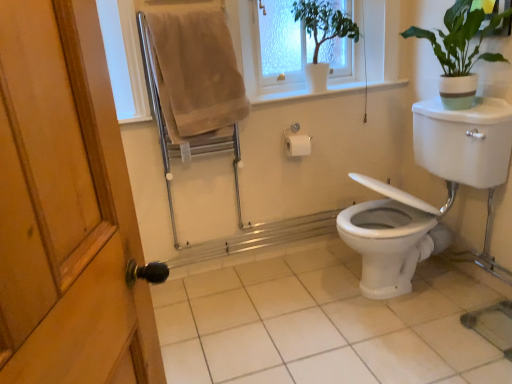
Question: From the image's perspective, does beige cotton towel at upper left appear lower than white glossy tile at center?

Choices:
 (A) no
 (B) yes

Answer: (A)

Question: Is beige cotton towel at upper left to the left of white glossy tile at center from the viewer's perspective?

Choices:
 (A) no
 (B) yes

Answer: (B)

Question: From the image's perspective, does beige cotton towel at upper left appear higher than white glossy tile at center?

Choices:
 (A) yes
 (B) no

Answer: (A)

Question: Can you confirm if beige cotton towel at upper left is shorter than white glossy tile at center?

Choices:
 (A) no
 (B) yes

Answer: (A)

Question: Could white glossy tile at center be considered to be inside beige cotton towel at upper left?

Choices:
 (A) yes
 (B) no

Answer: (B)

Question: From the image's perspective, is white glossy toilet at lower right positioned above or below white plastic window frame at upper center?

Choices:
 (A) below
 (B) above

Answer: (A)

Question: From a real-world perspective, relative to white plastic window frame at upper center, is white glossy toilet at lower right vertically above or below?

Choices:
 (A) above
 (B) below

Answer: (B)

Question: Which is correct: white glossy toilet at lower right is inside white plastic window frame at upper center, or outside of it?

Choices:
 (A) inside
 (B) outside

Answer: (B)

Question: Is white glossy toilet at lower right wider or thinner than white plastic window frame at upper center?

Choices:
 (A) thin
 (B) wide

Answer: (B)

Question: Relative to green matte plant at upper right, the second houseplant from the left, is white glossy toilet at lower right in front or behind?

Choices:
 (A) behind
 (B) front

Answer: (B)

Question: From a real-world perspective, relative to green matte plant at upper right, the second houseplant from the left, is white glossy toilet at lower right vertically above or below?

Choices:
 (A) below
 (B) above

Answer: (A)

Question: In terms of size, does white glossy toilet at lower right appear bigger or smaller than green matte plant at upper right, acting as the 1th houseplant starting from the right?

Choices:
 (A) small
 (B) big

Answer: (B)

Question: Is point (451, 170) closer or farther from the camera than point (440, 92)?

Choices:
 (A) closer
 (B) farther

Answer: (A)

Question: Is beige cotton towel at upper left spatially inside white glossy toilet at lower right, or outside of it?

Choices:
 (A) inside
 (B) outside

Answer: (B)

Question: From a real-world perspective, is beige cotton towel at upper left positioned above or below white glossy toilet at lower right?

Choices:
 (A) below
 (B) above

Answer: (B)